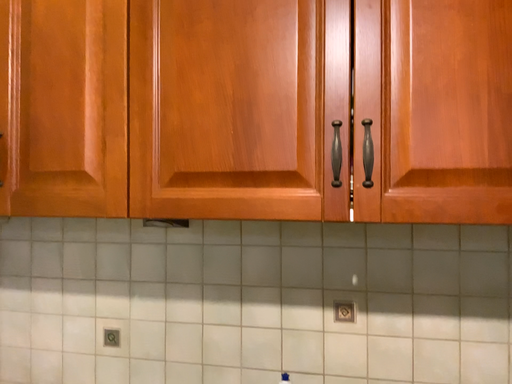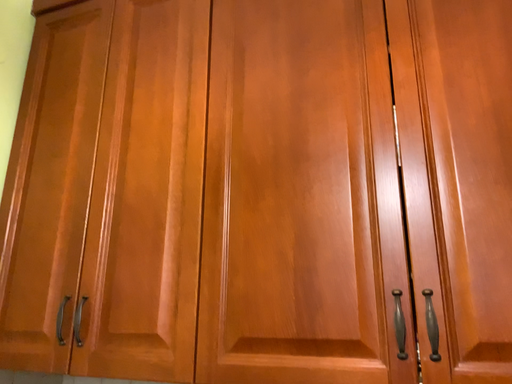
Question: How did the camera likely rotate when shooting the video?

Choices:
 (A) rotated left
 (B) rotated right

Answer: (A)